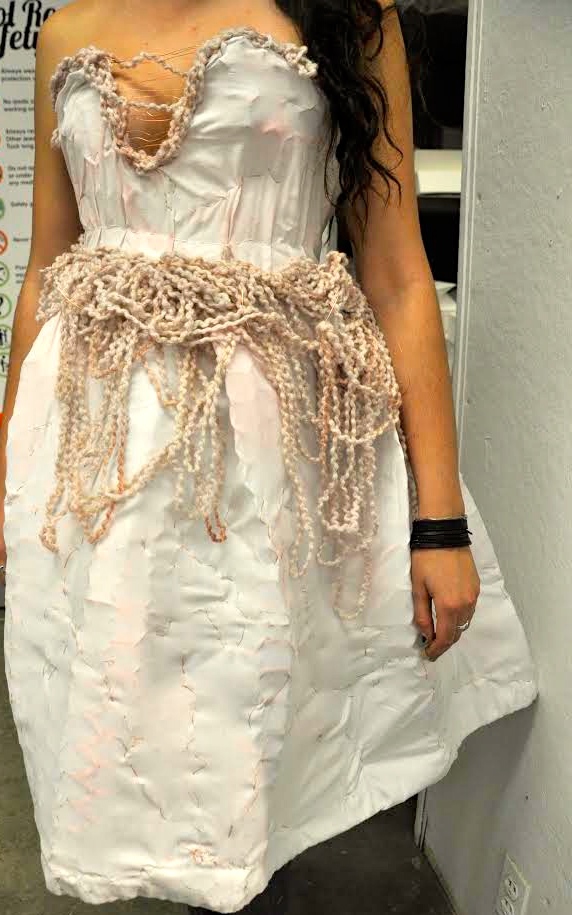
Locate an element on the screen. floor is located at coordinates (13, 887).